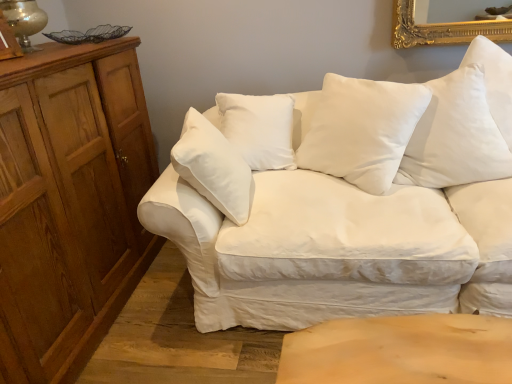
Question: From a real-world perspective, relative to white cotton couch at center, is matte gold table lamp at upper left vertically above or below?

Choices:
 (A) above
 (B) below

Answer: (A)

Question: Choose the correct answer: Is matte gold table lamp at upper left inside white cotton couch at center or outside it?

Choices:
 (A) outside
 (B) inside

Answer: (A)

Question: Which object is positioned closest to the wooden dresser at left?

Choices:
 (A) white cotton couch at center
 (B) white soft cushion at center, arranged as the first pillow when viewed from the left
 (C) matte gold table lamp at upper left
 (D) white cotton pillow at upper right, marked as the first pillow in a right-to-left arrangement

Answer: (C)

Question: Estimate the real-world distances between objects in this image. Which object is closer to the wooden dresser at left?

Choices:
 (A) white cotton pillow at upper right, the 2th pillow when ordered from left to right
 (B) white cotton couch at center
 (C) matte gold table lamp at upper left
 (D) white soft cushion at center, arranged as the first pillow when viewed from the left

Answer: (C)